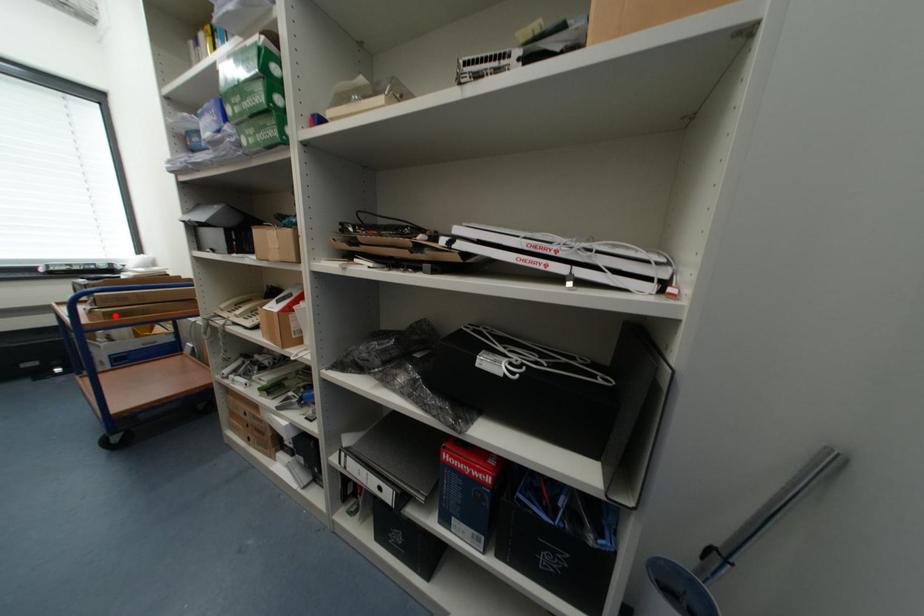
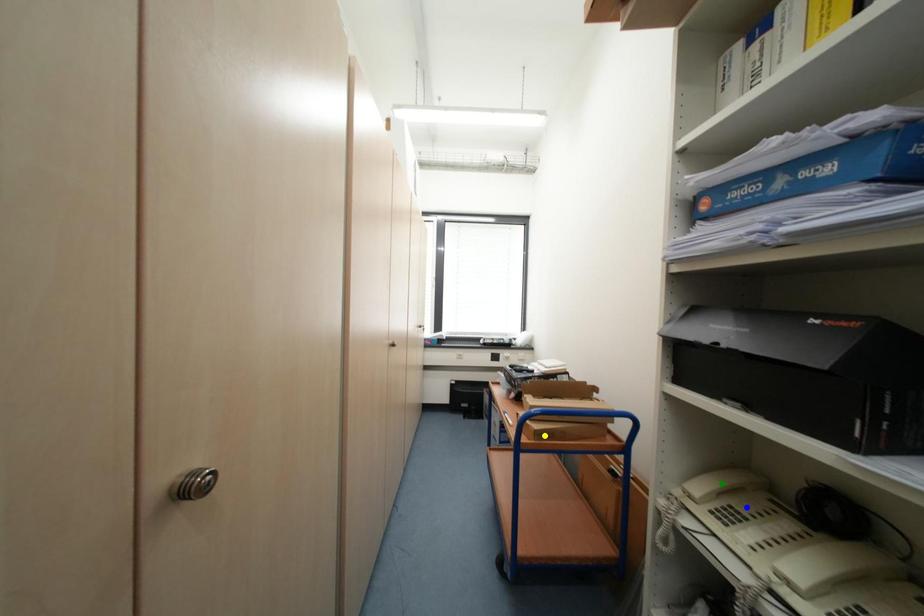
Question: I am providing you with two images of the same scene from different viewpoints. A red point is marked on the first image. You are given multiple points on the second image. Can you choose the point in image 2 that corresponds to the point in image 1?

Choices:
 (A) yellow point
 (B) blue point
 (C) green point

Answer: (A)